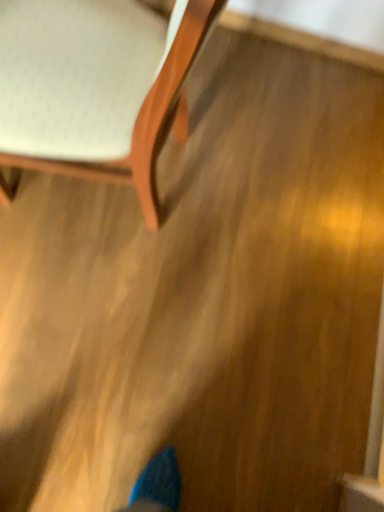
Locate an element on the screen. wooden chair at upper left is located at coordinates (95, 87).

The height and width of the screenshot is (512, 384). Describe the element at coordinates (95, 87) in the screenshot. I see `wooden chair at upper left` at that location.

Identify the location of wooden chair at upper left. (95, 87).